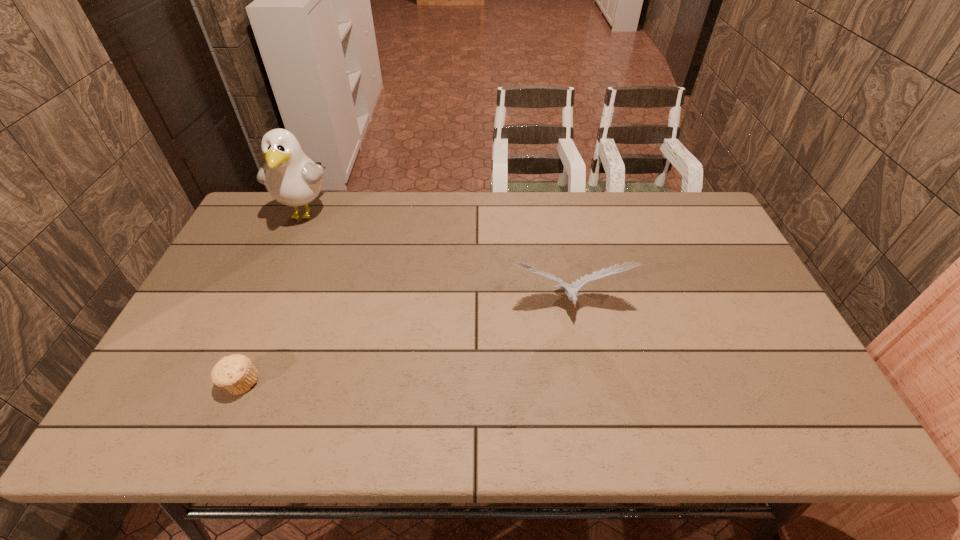
Where is `the closest object relative to the shortest object`? the closest object relative to the shortest object is located at coordinates (292, 178).

This screenshot has height=540, width=960. Find the location of `vacant space that satisfies the following two spatial constraints: 1. on the beak of the nearest object; 2. on the right side of the taller gull`. vacant space that satisfies the following two spatial constraints: 1. on the beak of the nearest object; 2. on the right side of the taller gull is located at coordinates (230, 383).

I want to click on vacant space that satisfies the following two spatial constraints: 1. on the beak of the nearest object; 2. on the right side of the tallest object, so click(x=230, y=383).

You are a GUI agent. You are given a task and a screenshot of the screen. Output one action in this format:
    pyautogui.click(x=<x>, y=<y>)
    Task: Click on the free space that satisfies the following two spatial constraints: 1. on the beak of the muffin; 2. on the left side of the tallest object
    This screenshot has width=960, height=540.
    Given the screenshot: What is the action you would take?
    pyautogui.click(x=230, y=383)